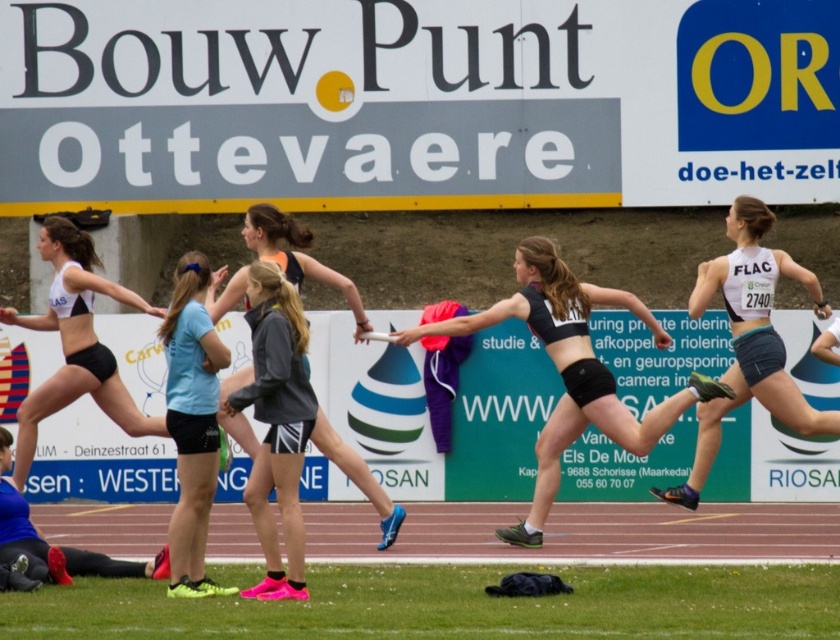
Is light blue fabric shirt at center further to the viewer compared to black matte shorts at left?

That is False.

Is light blue fabric shirt at center to the left of black matte shorts at left from the viewer's perspective?

In fact, light blue fabric shirt at center is to the right of black matte shorts at left.

What are the coordinates of `light blue fabric shirt at center` in the screenshot? It's located at click(x=192, y=422).

Is black matte sports bra at center wider than black matte jacket at center?

Yes, black matte sports bra at center is wider than black matte jacket at center.

Describe the element at coordinates (571, 369) in the screenshot. This screenshot has height=640, width=840. I see `black matte sports bra at center` at that location.

I want to click on black matte sports bra at center, so click(x=571, y=369).

This screenshot has height=640, width=840. In order to click on black matte sports bra at center in this screenshot , I will do `click(571, 369)`.

Does black matte sports bra at center appear on the right side of blue synthetic track shoe at lower left?

Yes, black matte sports bra at center is to the right of blue synthetic track shoe at lower left.

Describe the element at coordinates (571, 369) in the screenshot. I see `black matte sports bra at center` at that location.

Find the location of a particular element. The height and width of the screenshot is (640, 840). black matte sports bra at center is located at coordinates (571, 369).